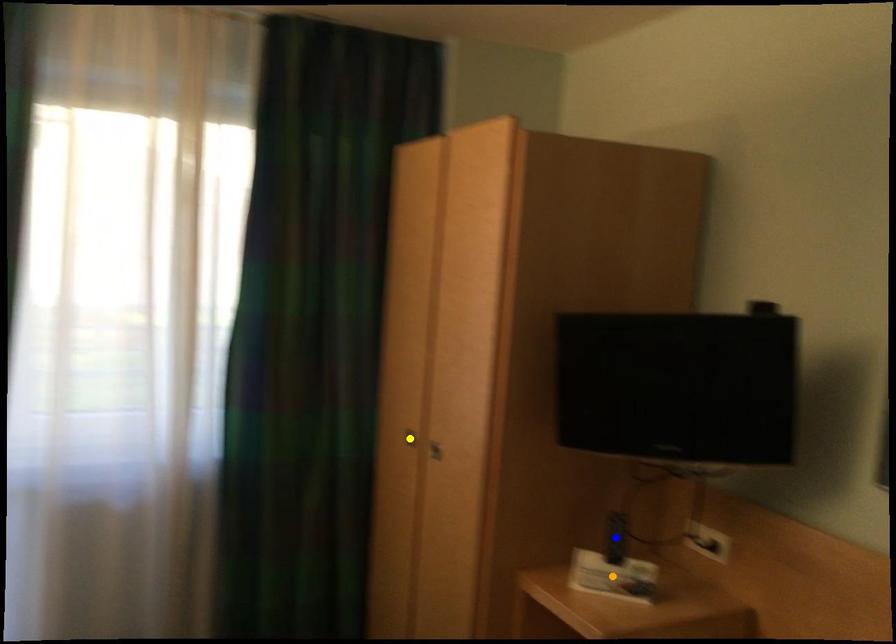
Looking at this image, order these from nearest to farthest:
orange point, blue point, yellow point

orange point → blue point → yellow point